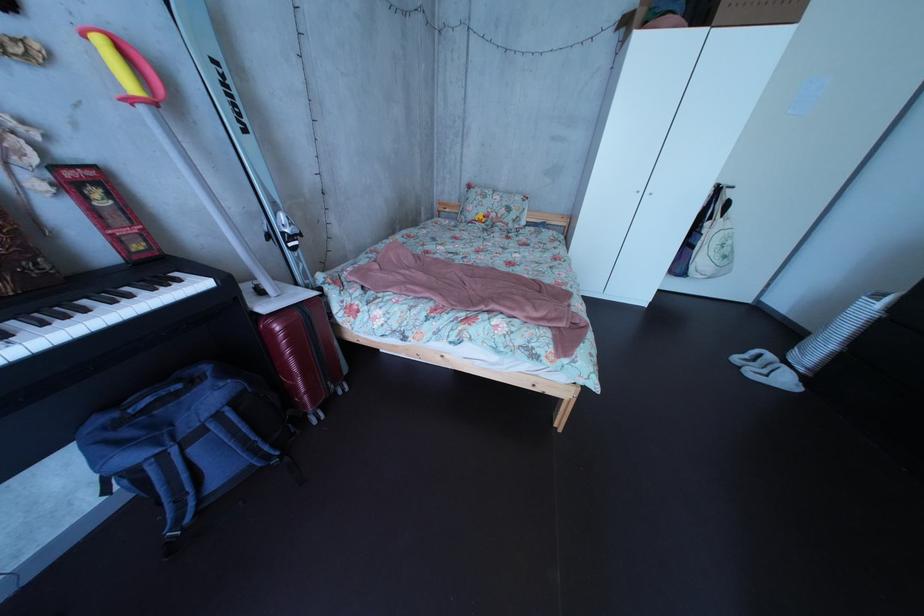
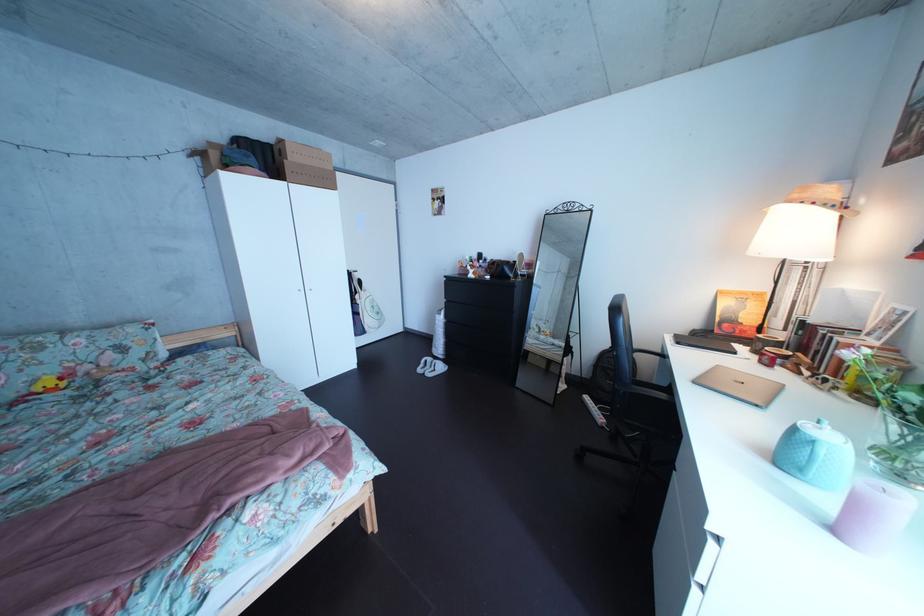
Question: The camera is either moving clockwise (left) or counter-clockwise (right) around the object. The first image is from the beginning of the video and the second image is from the end. Is the camera moving left or right when shooting the video?

Choices:
 (A) Left
 (B) Right

Answer: (A)